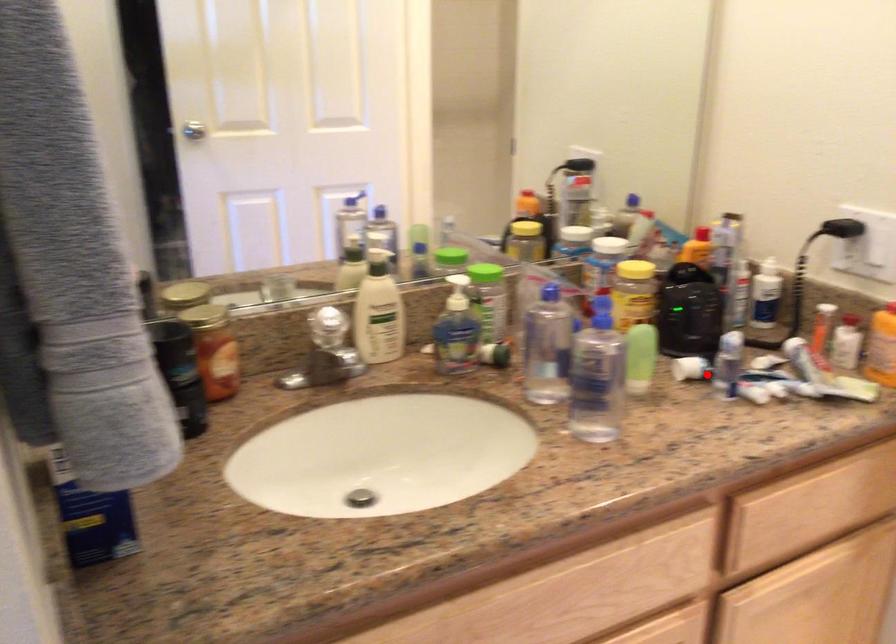
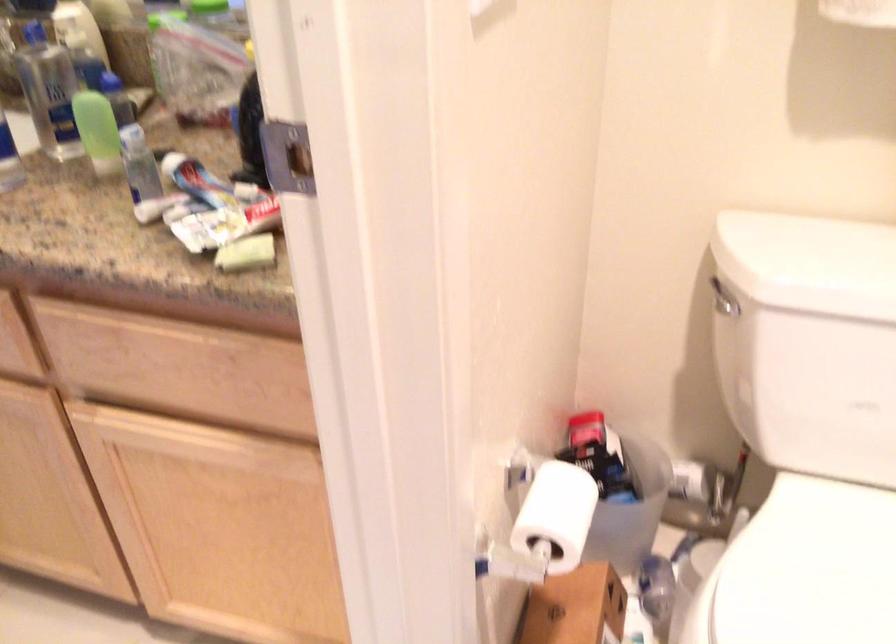
Question: I am providing you with two images of the same scene from different viewpoints. A red point is shown in image1. For the corresponding object point in image2, is it positioned nearer or farther from the camera?

Choices:
 (A) Nearer
 (B) Farther

Answer: (A)